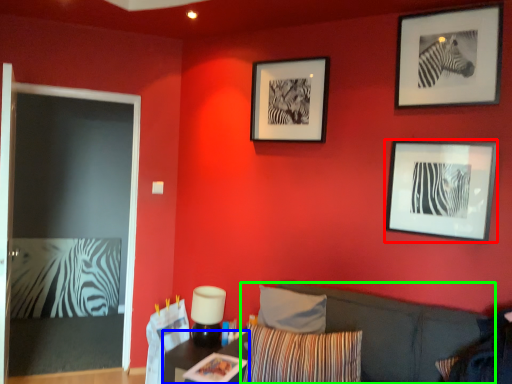
Question: Considering the real-world distances, which object is closest to picture frame (highlighted by a red box)? table (highlighted by a blue box) or couch (highlighted by a green box).

Choices:
 (A) table
 (B) couch

Answer: (B)